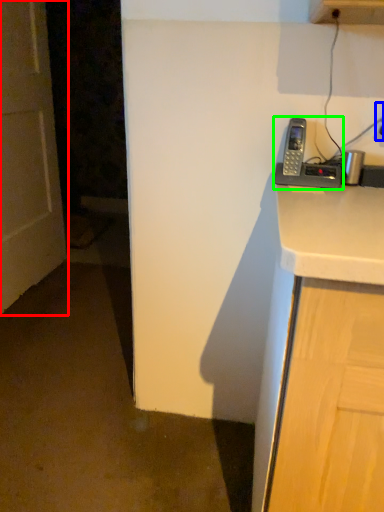
Question: Based on their relative distances, which object is farther from door (highlighted by a red box)? Choose from electric outlet (highlighted by a blue box) and corded phone (highlighted by a green box).

Choices:
 (A) electric outlet
 (B) corded phone

Answer: (A)